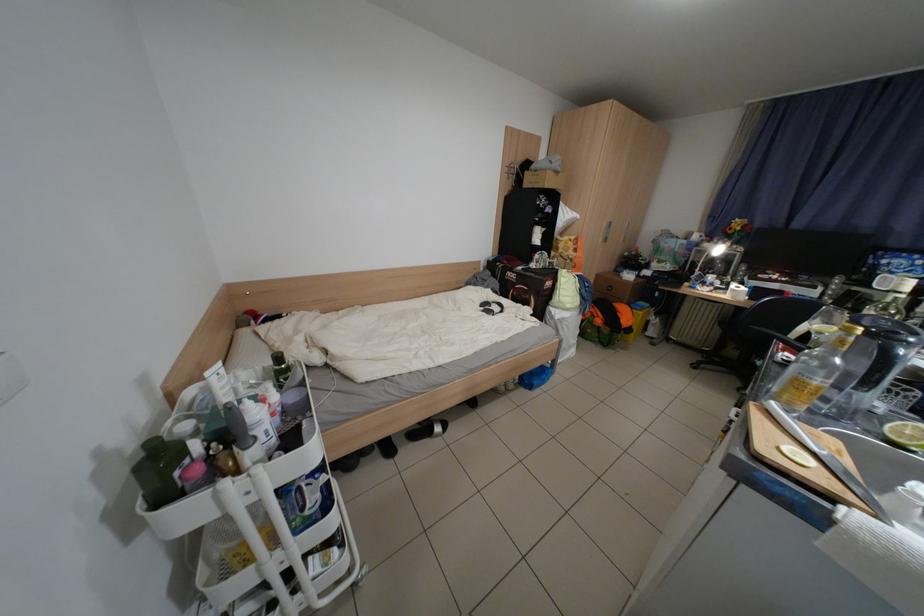
At what (x,y) coordinates should I click in order to perform the action: click on black chair armrest. Please return your answer as a coordinate pair (x, y). Looking at the image, I should click on (740, 308).